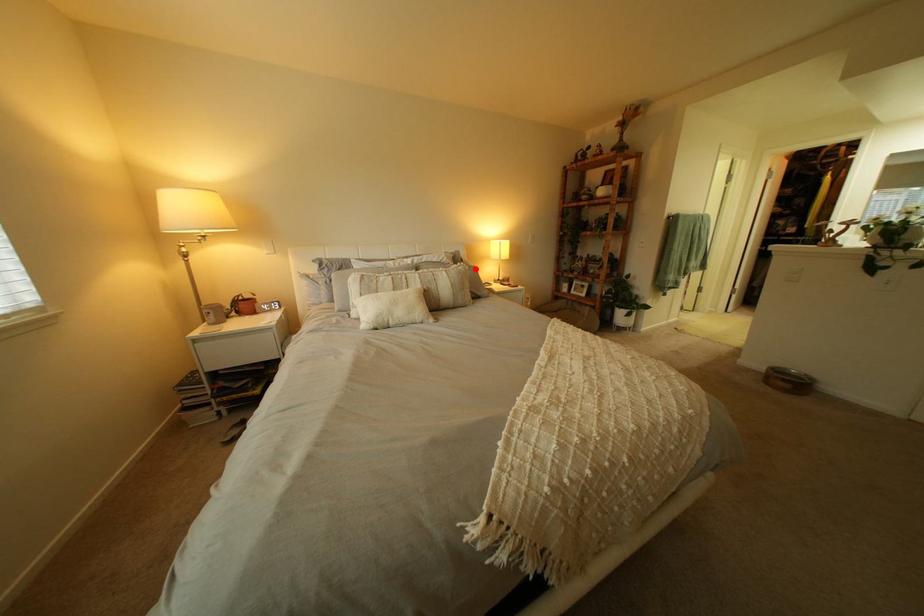
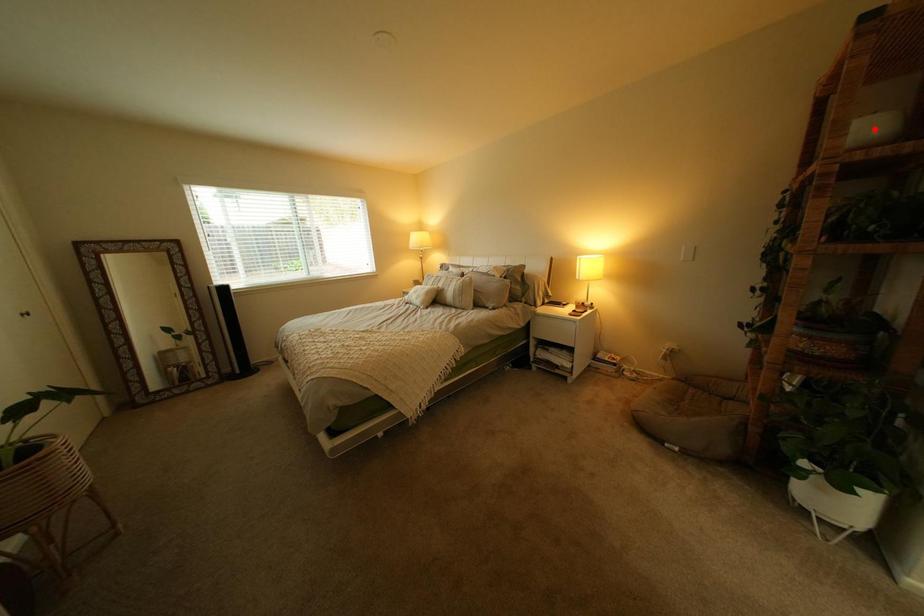
I am providing you with two images of the same scene from different viewpoints. A red point is marked on the first image and another point is marked on the second image. Do the highlighted points in image1 and image2 indicate the same real-world spot?

No